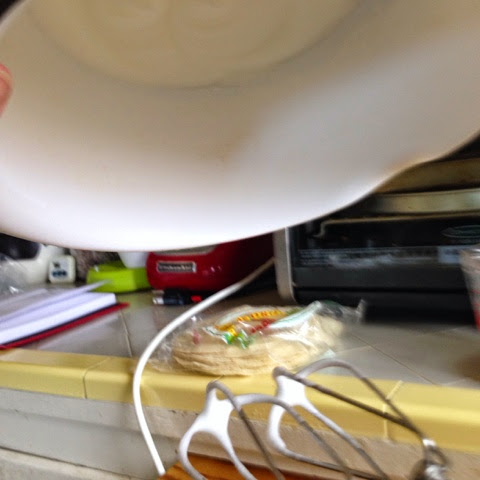
Locate an element on the screen. The image size is (480, 480). counter is located at coordinates (414, 365).